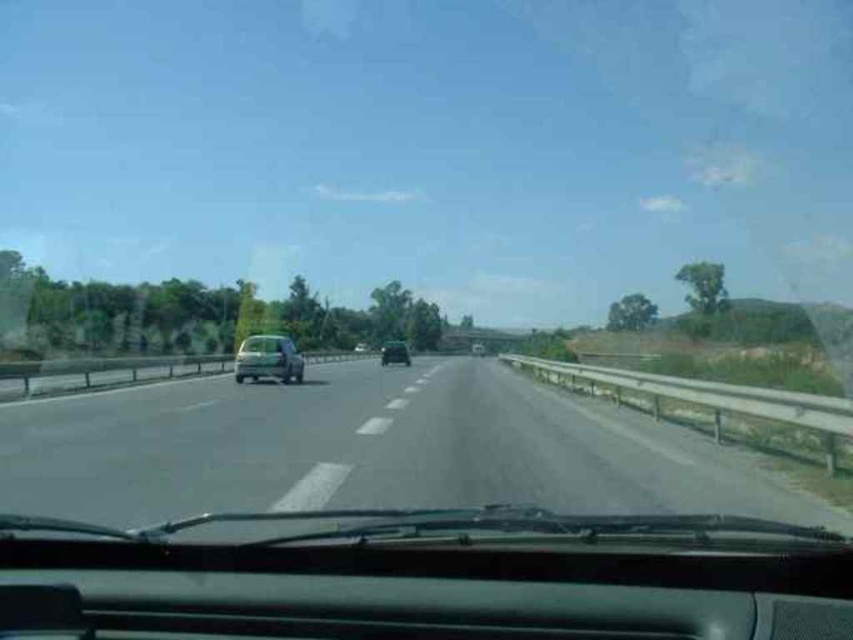
Is asphalt road at center taller than metallic silver car at left?

Incorrect, asphalt road at center's height is not larger of metallic silver car at left's.

Between asphalt road at center and metallic silver car at left, which one appears on the right side from the viewer's perspective?

Positioned to the right is asphalt road at center.

I want to click on asphalt road at center, so click(x=368, y=449).

Consider the image. Which is more to the right, metallic silver car at left or metallic silver sedan at center?

From the viewer's perspective, metallic silver sedan at center appears more on the right side.

Is metallic silver car at left thinner than metallic silver sedan at center?

Incorrect, metallic silver car at left's width is not less than metallic silver sedan at center's.

Who is more distant from viewer, (267, 355) or (474, 355)?

The point (474, 355) is more distant.

Where is `metallic silver car at left`? metallic silver car at left is located at coordinates (268, 358).

Can you confirm if asphalt road at center is shorter than metallic silver sedan at center?

Incorrect, asphalt road at center's height does not fall short of metallic silver sedan at center's.

Is point (463, 396) less distant than point (474, 342)?

Yes.

The image size is (853, 640). I want to click on asphalt road at center, so click(x=368, y=449).

This screenshot has width=853, height=640. What are the coordinates of `asphalt road at center` in the screenshot? It's located at (368, 449).